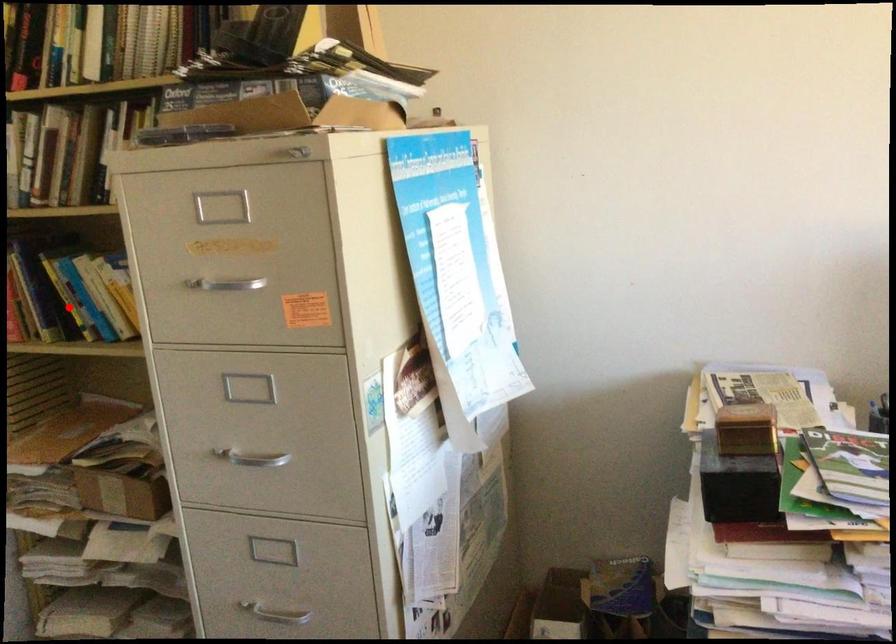
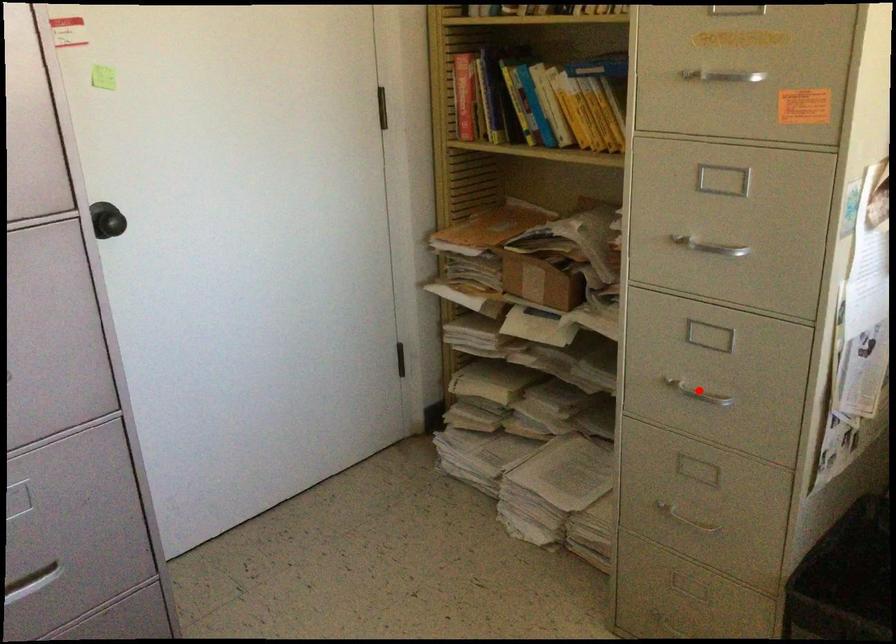
I am providing you with two images of the same scene from different viewpoints. A red point is marked on the first image and another point is marked on the second image. Is the red point in image1 aligned with the point shown in image2?

No